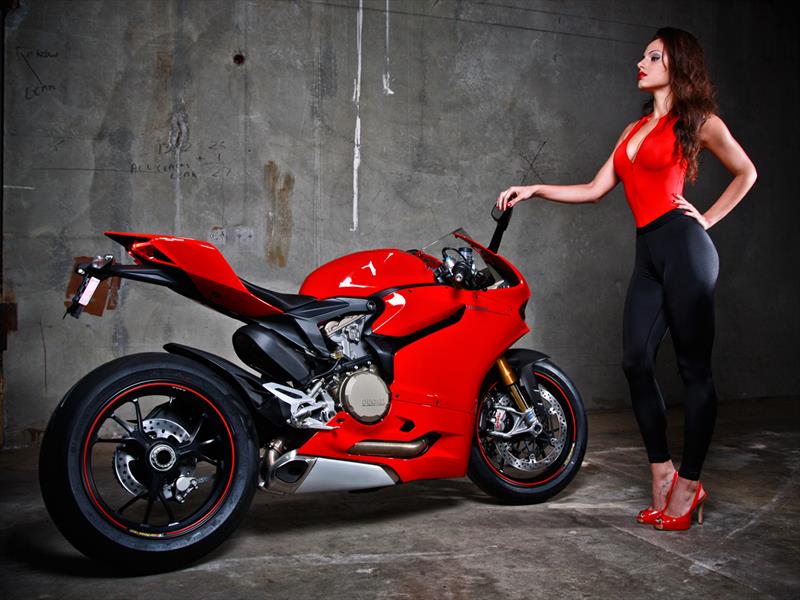
The image size is (800, 600). I want to click on seat, so click(x=261, y=326).